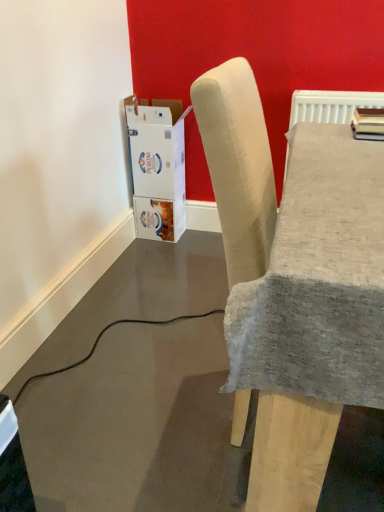
Question: Considering the relative positions of white cardboard box at lower left and beige fabric chair at center in the image provided, is white cardboard box at lower left to the left or to the right of beige fabric chair at center?

Choices:
 (A) right
 (B) left

Answer: (B)

Question: Relative to beige fabric chair at center, is white cardboard box at lower left in front or behind?

Choices:
 (A) front
 (B) behind

Answer: (B)

Question: From a real-world perspective, is white cardboard box at lower left positioned above or below beige fabric chair at center?

Choices:
 (A) below
 (B) above

Answer: (A)

Question: Is beige fabric chair at center to the left or to the right of white cardboard box at lower left in the image?

Choices:
 (A) left
 (B) right

Answer: (B)

Question: Considering their positions, is beige fabric chair at center located in front of or behind white cardboard box at lower left?

Choices:
 (A) behind
 (B) front

Answer: (B)

Question: Considering the positions of beige fabric chair at center and white cardboard box at lower left in the image, is beige fabric chair at center taller or shorter than white cardboard box at lower left?

Choices:
 (A) short
 (B) tall

Answer: (B)

Question: From the image's perspective, is beige fabric chair at center positioned above or below white cardboard box at lower left?

Choices:
 (A) below
 (B) above

Answer: (A)